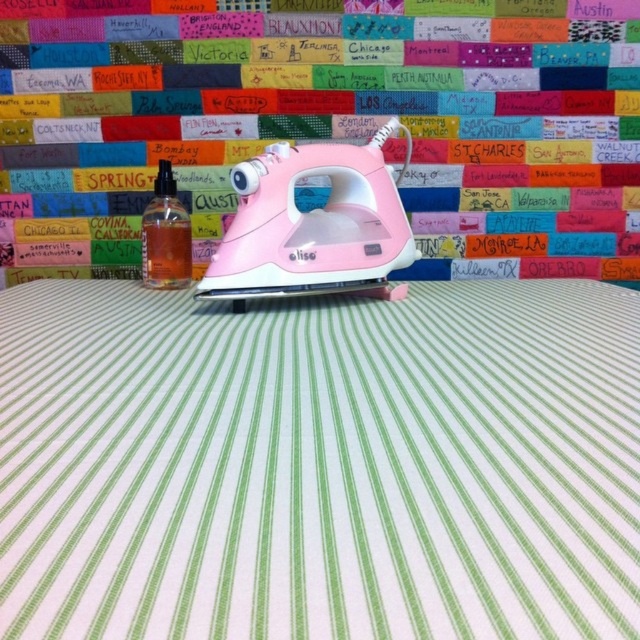
Question: Which object is closer to the camera taking this photo?

Choices:
 (A) translucent orange liquid at center
 (B) white striped fabric at center

Answer: (B)

Question: Does white striped fabric at center appear under translucent orange liquid at center?

Choices:
 (A) no
 (B) yes

Answer: (B)

Question: Does white striped fabric at center have a larger size compared to translucent orange liquid at center?

Choices:
 (A) yes
 (B) no

Answer: (A)

Question: Which point is closer to the camera?

Choices:
 (A) (129, 305)
 (B) (177, 220)

Answer: (A)

Question: Among these objects, which one is nearest to the camera?

Choices:
 (A) translucent orange liquid at center
 (B) white striped fabric at center

Answer: (B)

Question: Does white striped fabric at center appear on the left side of translucent orange liquid at center?

Choices:
 (A) no
 (B) yes

Answer: (A)